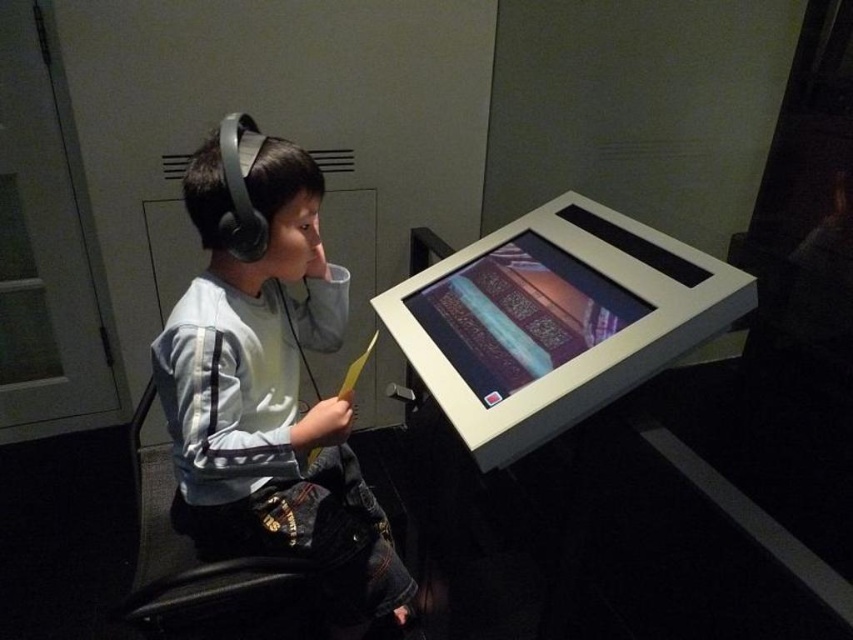
In the scene shown: Does light gray fabric shirt at center appear on the left side of black leather chair at left?

No, light gray fabric shirt at center is not to the left of black leather chair at left.

Who is positioned more to the right, light gray fabric shirt at center or black leather chair at left?

light gray fabric shirt at center

Which is in front, point (219, 216) or point (248, 579)?

Point (219, 216)

This screenshot has height=640, width=853. I want to click on light gray fabric shirt at center, so click(x=268, y=381).

Is light gray fabric shirt at center thinner than matte glass computer screen at center?

Incorrect, light gray fabric shirt at center's width is not less than matte glass computer screen at center's.

Who is higher up, light gray fabric shirt at center or matte glass computer screen at center?

matte glass computer screen at center is higher up.

Locate an element on the screen. The height and width of the screenshot is (640, 853). light gray fabric shirt at center is located at coordinates (268, 381).

I want to click on light gray fabric shirt at center, so click(268, 381).

Which is in front, point (538, 376) or point (136, 618)?

Point (136, 618) is in front.

Is point (482, 259) less distant than point (144, 609)?

No.

This screenshot has height=640, width=853. In order to click on matte glass computer screen at center in this screenshot , I will do `click(520, 314)`.